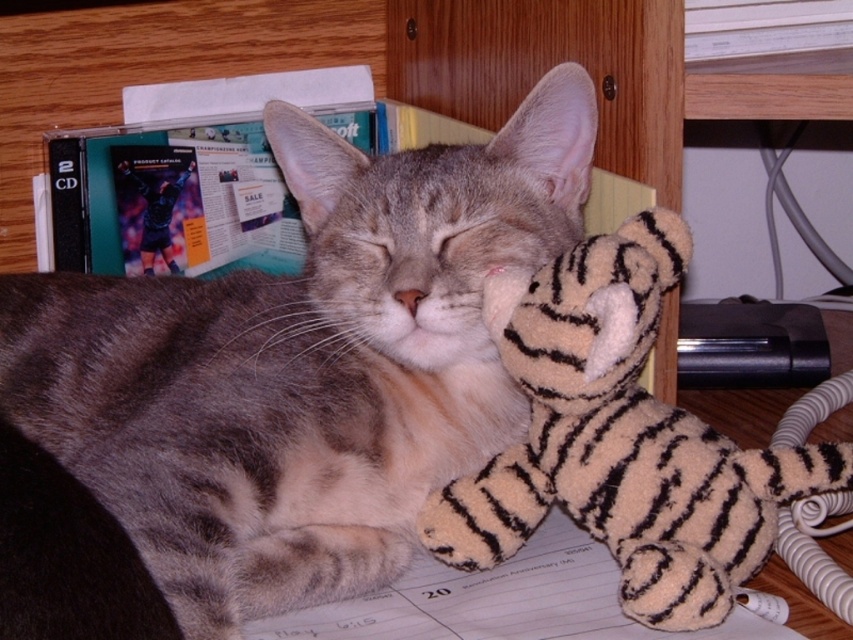
Who is taller, gray striped fur cat at center or fuzzy beige tiger at center?

With more height is gray striped fur cat at center.

Locate an element on the screen. gray striped fur cat at center is located at coordinates (279, 385).

What are the coordinates of `gray striped fur cat at center` in the screenshot? It's located at (279, 385).